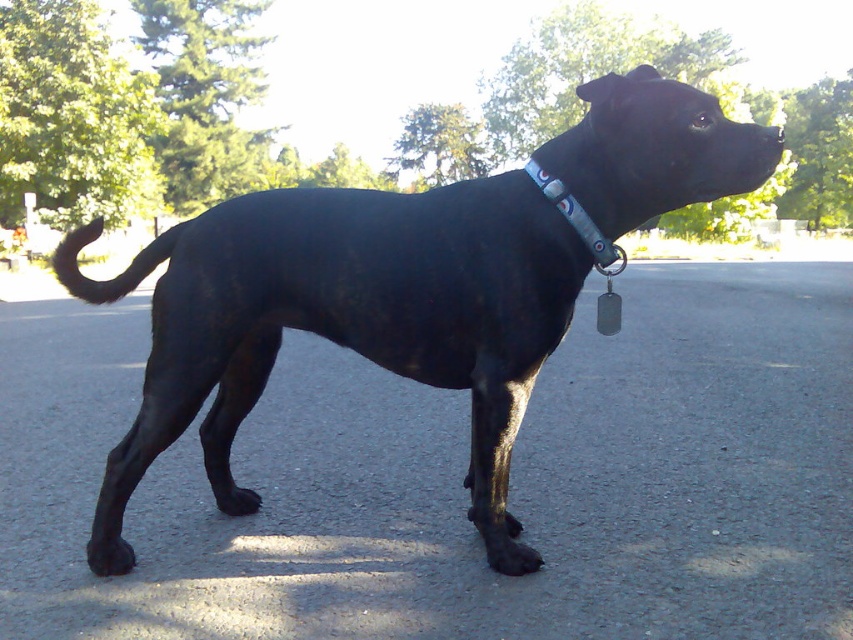
Question: Is black smooth dog at center bigger than blue fabric collar at upper center?

Choices:
 (A) no
 (B) yes

Answer: (B)

Question: Is the position of black smooth dog at center less distant than that of blue fabric collar at upper center?

Choices:
 (A) no
 (B) yes

Answer: (B)

Question: Is the position of black smooth dog at center more distant than that of blue fabric collar at upper center?

Choices:
 (A) yes
 (B) no

Answer: (B)

Question: Which object appears farthest from the camera in this image?

Choices:
 (A) blue fabric collar at upper center
 (B) black smooth dog at center

Answer: (A)